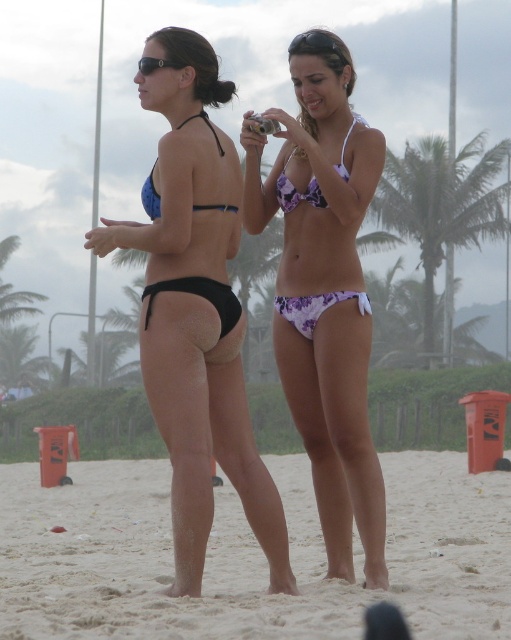
You are a photographer trying to capture a shot of the black matte bikini bottom at center and the green leafy palm tree at upper center. Given that the palm tree is in the distance, will the bikini bottom appear larger or smaller in the photo compared to the palm tree?

The black matte bikini bottom at center is 110.29 feet away from the green leafy palm tree at upper center. Since the bikini bottom is closer to the camera than the palm tree, it will appear larger in the photo.

You are a photographer trying to capture a shot of the black matte bikini bottom at center and the green leafy palm tree at upper center. Based on their positions, can you tell which object is closer to the camera?

The black matte bikini bottom at center is below the green leafy palm tree at upper center, so the bikini bottom is closer to the camera than the palm tree.

You are a fashion designer observing two bikinis on a beach. You need to determine which bikini bottom has a larger size between the black matte bikini bottom at center and the purple floral fabric bikini at center based on the visual cues provided. Which one is larger?

The black matte bikini bottom at center is larger in size than the purple floral fabric bikini at center.